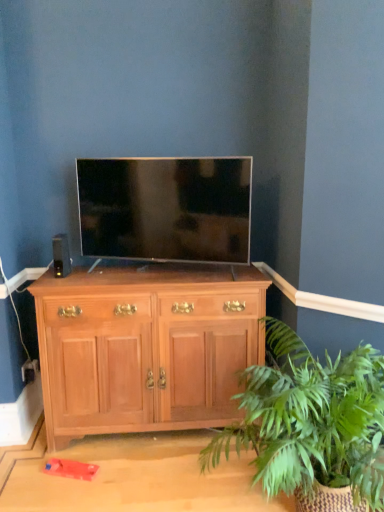
Where is `light brown wood cabinet at center`? The image size is (384, 512). light brown wood cabinet at center is located at coordinates (146, 347).

Where is `matte black tv at center`? This screenshot has height=512, width=384. matte black tv at center is located at coordinates (165, 208).

Locate an element on the screen. The image size is (384, 512). light brown wood cabinet at center is located at coordinates (146, 347).

Is point (65, 265) closer to camera compared to point (153, 320)?

No.

From a real-world perspective, is black matte speaker at left above or below light brown wood cabinet at center?

black matte speaker at left is above light brown wood cabinet at center.

In terms of size, does black matte speaker at left appear bigger or smaller than light brown wood cabinet at center?

black matte speaker at left is smaller than light brown wood cabinet at center.

Is light brown wood cabinet at center shorter than matte black tv at center?

No, light brown wood cabinet at center is not shorter than matte black tv at center.

This screenshot has height=512, width=384. What are the coordinates of `chest of drawers below the matte black tv at center (from a real-world perspective)` in the screenshot? It's located at (146, 347).

From the image's perspective, which is above, light brown wood cabinet at center or matte black tv at center?

matte black tv at center appears higher in the image.

Is light brown wood cabinet at center next to matte black tv at center and touching it?

There is a gap between light brown wood cabinet at center and matte black tv at center.

Which object is wider, matte black tv at center or light brown wood cabinet at center?

light brown wood cabinet at center is wider.

The width and height of the screenshot is (384, 512). What are the coordinates of `television above the light brown wood cabinet at center (from the image's perspective)` in the screenshot? It's located at (165, 208).

How different are the orientations of matte black tv at center and light brown wood cabinet at center in degrees?

The facing directions of matte black tv at center and light brown wood cabinet at center are 19.8 degrees apart.

Does matte black tv at center have a smaller size compared to light brown wood cabinet at center?

Correct, matte black tv at center occupies less space than light brown wood cabinet at center.

Is green leafy plant at lower right positioned with its back to black matte speaker at left?

No, black matte speaker at left is not at the back of green leafy plant at lower right.

Based on the photo, can you confirm if green leafy plant at lower right is smaller than black matte speaker at left?

No.

Is green leafy plant at lower right at the right side of black matte speaker at left?

Yes.

Looking at this image, who is smaller, matte black tv at center or green leafy plant at lower right?

With smaller size is matte black tv at center.

Which is behind, point (145, 166) or point (264, 424)?

Positioned behind is point (145, 166).

Is matte black tv at center behind green leafy plant at lower right?

Yes, matte black tv at center is further from the viewer.

From the image's perspective, between matte black tv at center and green leafy plant at lower right, who is located below?

From the image's view, green leafy plant at lower right is below.

Is matte black tv at center completely or partially outside of black matte speaker at left?

Yes, matte black tv at center is not within black matte speaker at left.

Based on the photo, can you confirm if matte black tv at center is bigger than black matte speaker at left?

Indeed, matte black tv at center has a larger size compared to black matte speaker at left.

Is matte black tv at center not near black matte speaker at left?

No.

Would you say light brown wood cabinet at center is inside or outside green leafy plant at lower right?

light brown wood cabinet at center cannot be found inside green leafy plant at lower right.

Is light brown wood cabinet at center taller or shorter than green leafy plant at lower right?

In the image, light brown wood cabinet at center appears to be taller than green leafy plant at lower right.

From the picture: Considering the relative positions of light brown wood cabinet at center and green leafy plant at lower right in the image provided, is light brown wood cabinet at center in front of green leafy plant at lower right?

That is False.

In the scene shown: Which of these two, light brown wood cabinet at center or green leafy plant at lower right, is thinner?

light brown wood cabinet at center is thinner.

In the image, there is a black matte speaker at left. Where is `the chest of drawers below it (from the image's perspective)`? Image resolution: width=384 pixels, height=512 pixels. the chest of drawers below it (from the image's perspective) is located at coordinates (146, 347).

Locate an element on the screen. The height and width of the screenshot is (512, 384). television to the right of light brown wood cabinet at center is located at coordinates point(165,208).

Considering their positions, is light brown wood cabinet at center positioned further to green leafy plant at lower right than matte black tv at center?

Based on the image, matte black tv at center appears to be further to green leafy plant at lower right.

From the image, which object appears to be nearer to green leafy plant at lower right, light brown wood cabinet at center or black matte speaker at left?

light brown wood cabinet at center is closer to green leafy plant at lower right.

Estimate the real-world distances between objects in this image. Which object is further from matte black tv at center, light brown wood cabinet at center or green leafy plant at lower right?

green leafy plant at lower right is positioned further to the anchor matte black tv at center.

In the scene shown: Estimate the real-world distances between objects in this image. Which object is further from light brown wood cabinet at center, black matte speaker at left or green leafy plant at lower right?

black matte speaker at left is positioned further to the anchor light brown wood cabinet at center.

Considering their positions, is black matte speaker at left positioned further to matte black tv at center than green leafy plant at lower right?

The object further to matte black tv at center is green leafy plant at lower right.

When comparing their distances from matte black tv at center, does green leafy plant at lower right or black matte speaker at left seem closer?

Based on the image, black matte speaker at left appears to be nearer to matte black tv at center.

Based on the photo, based on their spatial positions, is green leafy plant at lower right or black matte speaker at left closer to light brown wood cabinet at center?

Among the two, green leafy plant at lower right is located nearer to light brown wood cabinet at center.

From the image, which object appears to be farther from black matte speaker at left, light brown wood cabinet at center or matte black tv at center?

light brown wood cabinet at center.

At what (x,y) coordinates should I click in order to perform the action: click on television between green leafy plant at lower right and light brown wood cabinet at center along the z-axis. Please return your answer as a coordinate pair (x, y). Looking at the image, I should click on (165, 208).

Where is `speaker between matte black tv at center and light brown wood cabinet at center in the up-down direction`? speaker between matte black tv at center and light brown wood cabinet at center in the up-down direction is located at coordinates (61, 255).

You are a GUI agent. You are given a task and a screenshot of the screen. Output one action in this format:
    pyautogui.click(x=<x>, y=<y>)
    Task: Click on the chest of drawers between green leafy plant at lower right and black matte speaker at left from front to back
    The height and width of the screenshot is (512, 384).
    Given the screenshot: What is the action you would take?
    pyautogui.click(x=146, y=347)

Image resolution: width=384 pixels, height=512 pixels. I want to click on television between green leafy plant at lower right and black matte speaker at left along the z-axis, so click(165, 208).